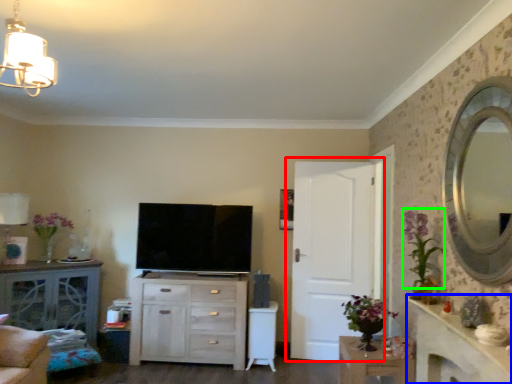
Question: Considering the real-world distances, which object is closest to door (highlighted by a red box)? counter top (highlighted by a blue box) or floral arrangement (highlighted by a green box).

Choices:
 (A) counter top
 (B) floral arrangement

Answer: (B)